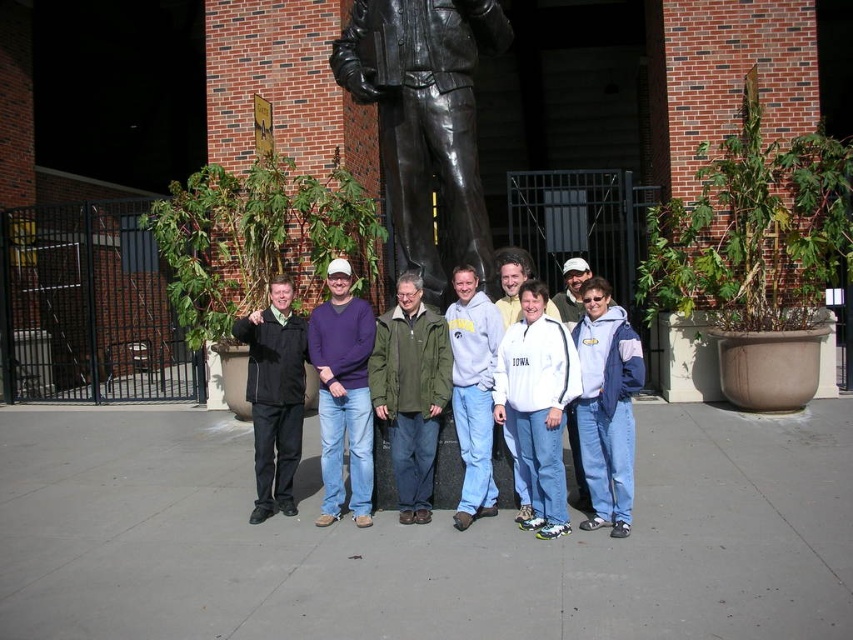
In the scene shown: You are a photographer trying to capture a clear shot of both the white fleece jacket at center and the black matte jacket at center. Since you want to ensure both jackets are fully visible in the frame, which jacket should you adjust your camera angle to focus on first?

The white fleece jacket at center is shorter than the black matte jacket at center. To ensure both are fully visible, focus on the taller black matte jacket at center first, then adjust to include the shorter white fleece jacket at center in the frame.